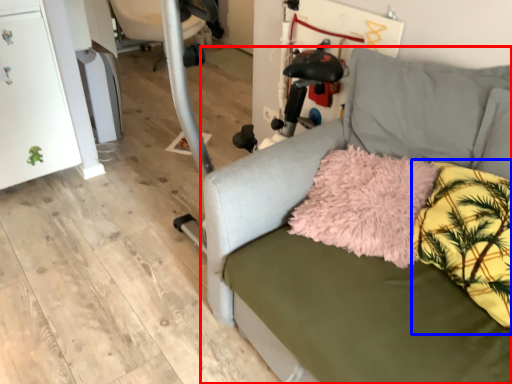
Question: Which object appears farthest to the camera in this image, studio couch (highlighted by a red box) or pillow (highlighted by a blue box)?

Choices:
 (A) studio couch
 (B) pillow

Answer: (B)